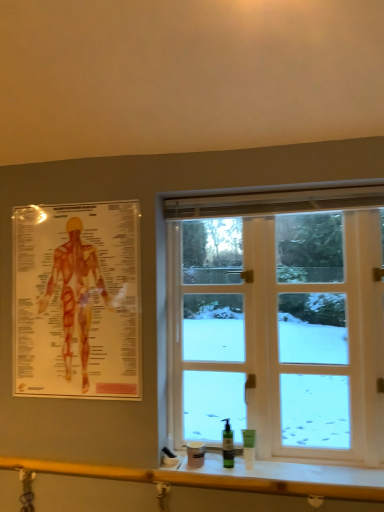
At what (x,y) coordinates should I click in order to perform the action: click on vacant space that is to the left of green plastic bottle at lower right, which appears as the 1th toiletry when viewed from the right. Please return your answer as a coordinate pair (x, y). The image size is (384, 512). Looking at the image, I should click on (224, 459).